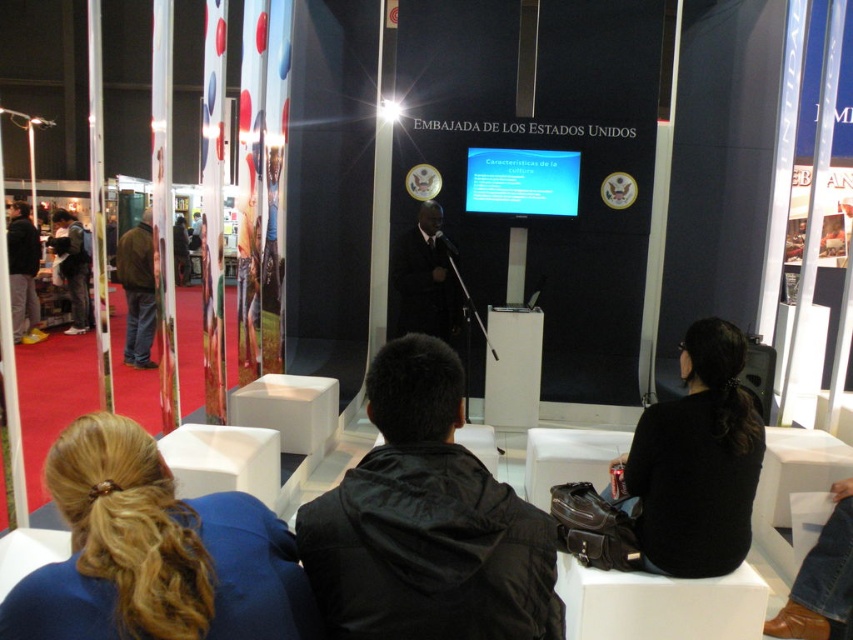
Question: Which object is the closest to the gray fabric pants at left?

Choices:
 (A) dark blue jacket at left
 (B) matte blue screen at center
 (C) blonde hair at lower left
 (D) black matte sweater at lower right

Answer: (A)

Question: Which point is closer to the camera?

Choices:
 (A) dark blue jacket at left
 (B) black matte sweater at lower right
 (C) blonde hair at lower left

Answer: (C)

Question: Can you confirm if blonde hair at lower left is positioned below matte black suit at center?

Choices:
 (A) yes
 (B) no

Answer: (A)

Question: Does brown leather jacket at left have a smaller size compared to dark blue jacket at left?

Choices:
 (A) yes
 (B) no

Answer: (B)

Question: Among these objects, which one is farthest from the camera?

Choices:
 (A) brown leather jacket at left
 (B) gray fabric pants at left
 (C) black matte jacket at center
 (D) matte black suit at center

Answer: (B)

Question: Can you confirm if matte black suit at center is bigger than gray fabric pants at left?

Choices:
 (A) yes
 (B) no

Answer: (B)